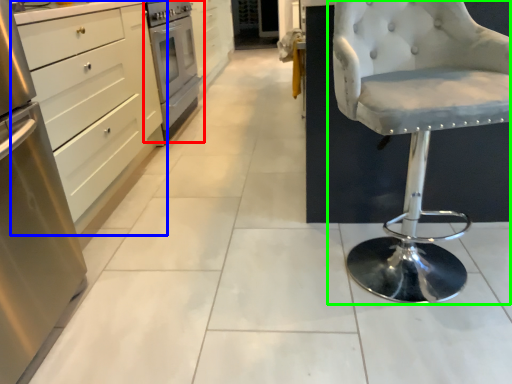
Question: Based on their relative distances, which object is farther from home appliance (highlighted by a red box)? Choose from cabinetry (highlighted by a blue box) and chair (highlighted by a green box).

Choices:
 (A) cabinetry
 (B) chair

Answer: (B)